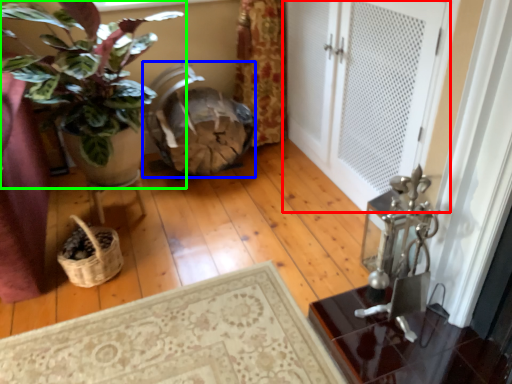
Question: Which object is the closest to the door (highlighted by a red box)? Choose among these: rocking chair (highlighted by a blue box) or houseplant (highlighted by a green box).

Choices:
 (A) rocking chair
 (B) houseplant

Answer: (A)